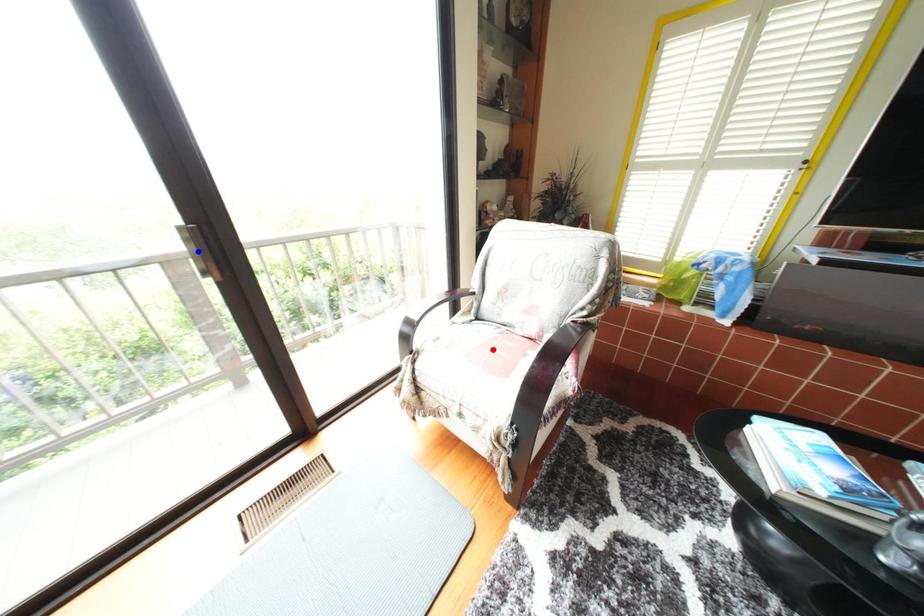
Question: In the image, two points are highlighted. Which point is nearer to the camera? Reply with the corresponding letter.

Choices:
 (A) blue point
 (B) red point

Answer: (A)